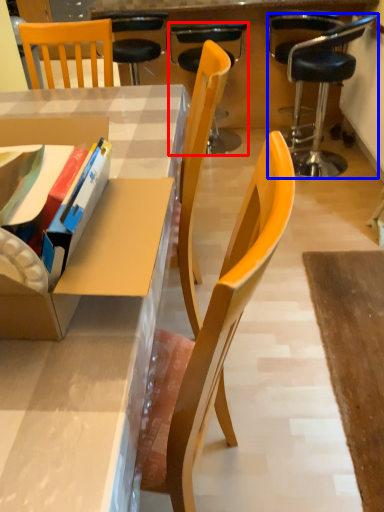
Question: Among these objects, which one is farthest to the camera, chair (highlighted by a red box) or chair (highlighted by a blue box)?

Choices:
 (A) chair
 (B) chair

Answer: (A)